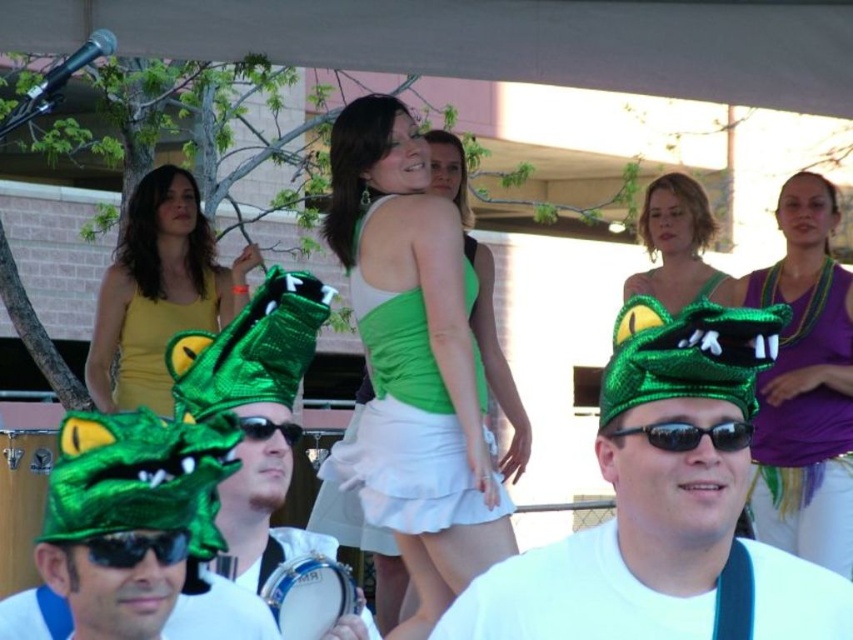
Question: Which of the following is the closest to the observer?

Choices:
 (A) (375, 333)
 (B) (296, 435)
 (C) (682, 468)
 (D) (138, 538)

Answer: (D)

Question: Considering the real-world distances, which object is farthest from the green shiny goggles at lower left?

Choices:
 (A) metallic silver drum at lower center
 (B) yellow matte tank top at upper left

Answer: (B)

Question: Is yellow matte tank top at upper left positioned at the back of black reflective sunglasses at center?

Choices:
 (A) yes
 (B) no

Answer: (A)

Question: Which object appears farthest from the camera in this image?

Choices:
 (A) green shiny goggles at lower left
 (B) green sequined hat at upper center

Answer: (B)

Question: Is green shiny crocodile hat at center below metallic silver drum at lower center?

Choices:
 (A) yes
 (B) no

Answer: (B)

Question: Considering the relative positions of green shiny crocodile hat at center and yellow matte tank top at upper left in the image provided, where is green shiny crocodile hat at center located with respect to yellow matte tank top at upper left?

Choices:
 (A) left
 (B) right

Answer: (B)